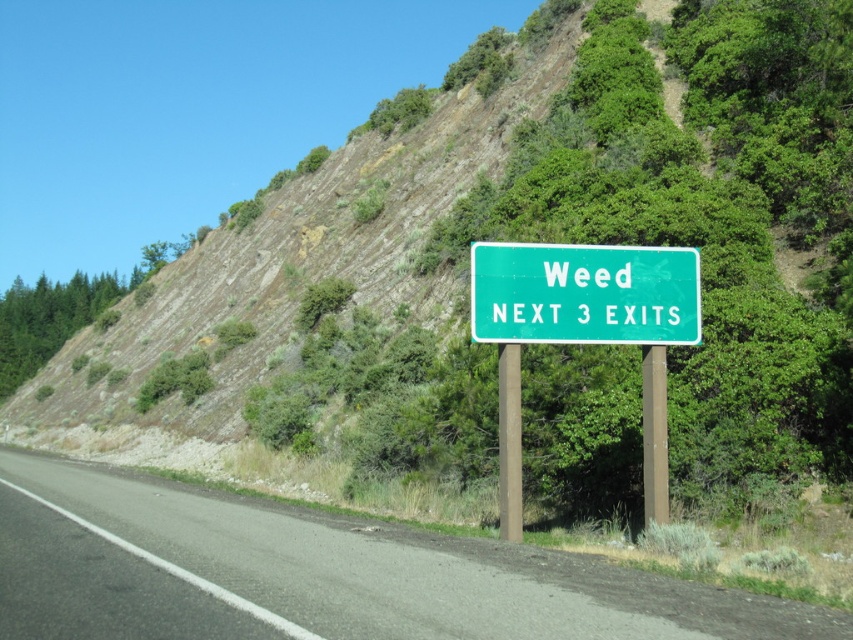
Who is more forward, (407, 636) or (544, 248)?

Point (407, 636) is in front.

Can you confirm if asphalt road at center is positioned to the left of green metal sign at center?

Indeed, asphalt road at center is positioned on the left side of green metal sign at center.

Is point (451, 545) closer to camera compared to point (509, 392)?

Yes, it is.

Where is `asphalt road at center`? This screenshot has width=853, height=640. asphalt road at center is located at coordinates (320, 573).

In the scene shown: Does green metal sign at center have a lesser height compared to green metallic sign at center?

No, green metal sign at center is not shorter than green metallic sign at center.

Does point (479, 307) come behind point (648, 256)?

No.

Locate an element on the screen. green metal sign at center is located at coordinates (583, 333).

Is point (641, 577) in front of point (502, 285)?

Yes.

Does asphalt road at center appear under green metallic sign at center?

Yes, asphalt road at center is below green metallic sign at center.

In order to click on asphalt road at center in this screenshot , I will do `click(320, 573)`.

At what (x,y) coordinates should I click in order to perform the action: click on asphalt road at center. Please return your answer as a coordinate pair (x, y). This screenshot has width=853, height=640. Looking at the image, I should click on (320, 573).